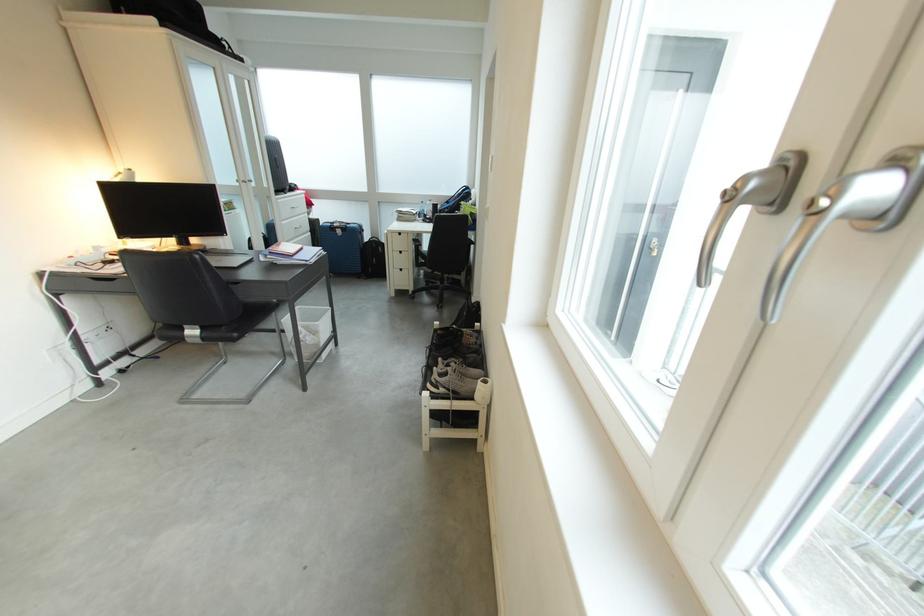
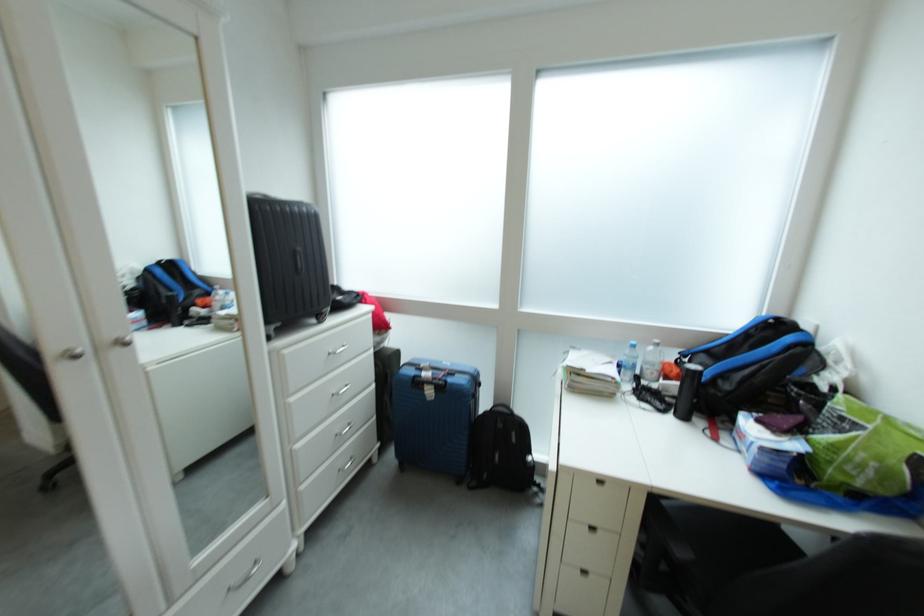
Locate, in the second image, the point that corresponds to point (422, 217) in the first image.

(622, 383)